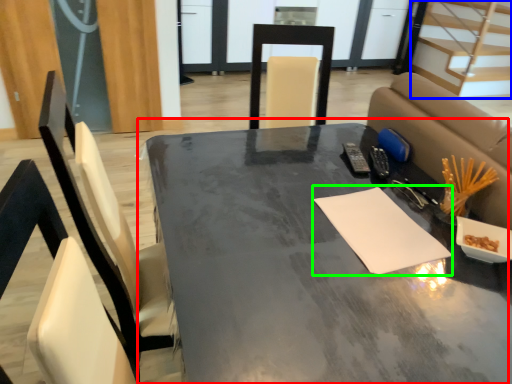
Question: Which is nearer to the table (highlighted by a red box)? stairwell (highlighted by a blue box) or notepad (highlighted by a green box).

Choices:
 (A) stairwell
 (B) notepad

Answer: (B)